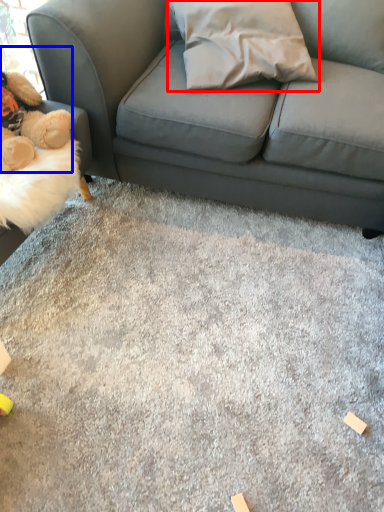
Question: Which object appears closest to the camera in this image, throw pillow (highlighted by a red box) or toy (highlighted by a blue box)?

Choices:
 (A) throw pillow
 (B) toy

Answer: (B)